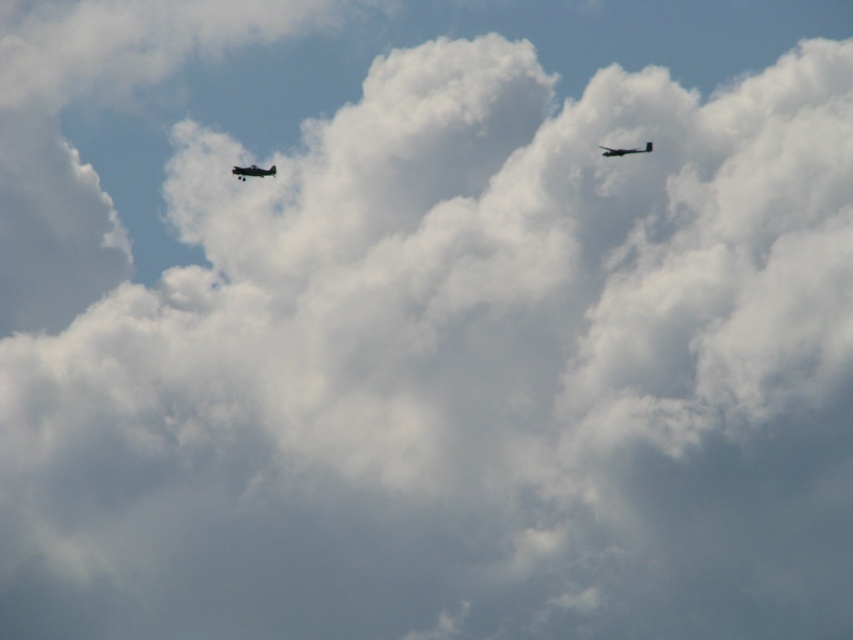
Does shiny silver airplane at upper left appear under metallic gray airplane at upper right?

Yes, shiny silver airplane at upper left is below metallic gray airplane at upper right.

Does shiny silver airplane at upper left have a lesser height compared to metallic gray airplane at upper right?

Indeed, shiny silver airplane at upper left has a lesser height compared to metallic gray airplane at upper right.

Does point (250, 166) come in front of point (646, 148)?

Yes, point (250, 166) is in front of point (646, 148).

Where is `shiny silver airplane at upper left`? This screenshot has height=640, width=853. shiny silver airplane at upper left is located at coordinates (252, 172).